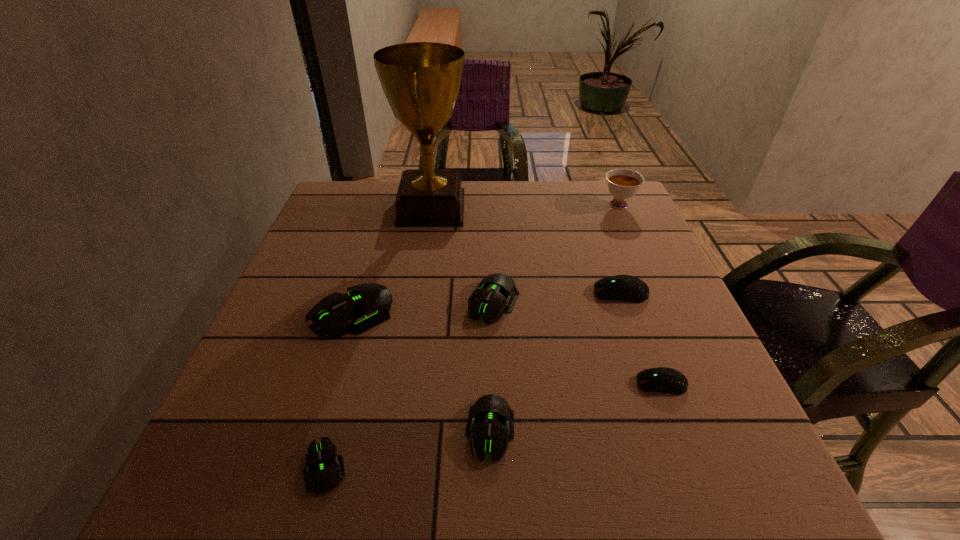
At what (x,y) coordinates should I click in order to perform the action: click on free space between the shortest computer mouse and the gold award. Please return your answer as a coordinate pair (x, y). The image size is (960, 540). Looking at the image, I should click on (379, 338).

I want to click on free point between the second smallest gray computer mouse and the second biggest gray computer mouse, so click(x=492, y=367).

Identify the location of vacant space in between the second biggest gray computer mouse and the shortest object. The height and width of the screenshot is (540, 960). (410, 385).

You are a GUI agent. You are given a task and a screenshot of the screen. Output one action in this format:
    pyautogui.click(x=<x>, y=<y>)
    Task: Click on the free space that is in between the second biggest gray computer mouse and the second smallest gray computer mouse
    
    Given the screenshot: What is the action you would take?
    pyautogui.click(x=492, y=367)

Where is `vacant area that lies between the biggest gray computer mouse and the third smallest gray computer mouse`? vacant area that lies between the biggest gray computer mouse and the third smallest gray computer mouse is located at coordinates (423, 308).

Locate which object is the closest to the second smallest gray computer mouse. Please provide its 2D coordinates. Your answer should be formatted as a tuple, i.e. [(x, y)], where the tuple contains the x and y coordinates of a point satisfying the conditions above.

[(495, 293)]

What are the coordinates of `object that stands as the closest to the tallest object` in the screenshot? It's located at (495, 293).

Locate an element on the screen. computer mouse that is the nearest to the second biggest gray computer mouse is located at coordinates (367, 305).

Point out which computer mouse is positioned as the second nearest to the shortest object. Please provide its 2D coordinates. Your answer should be formatted as a tuple, i.e. [(x, y)], where the tuple contains the x and y coordinates of a point satisfying the conditions above.

[(367, 305)]

At what (x,y) coordinates should I click in order to perform the action: click on gray computer mouse that stands as the third closest to the second biggest gray computer mouse. Please return your answer as a coordinate pair (x, y). Image resolution: width=960 pixels, height=540 pixels. Looking at the image, I should click on (323, 470).